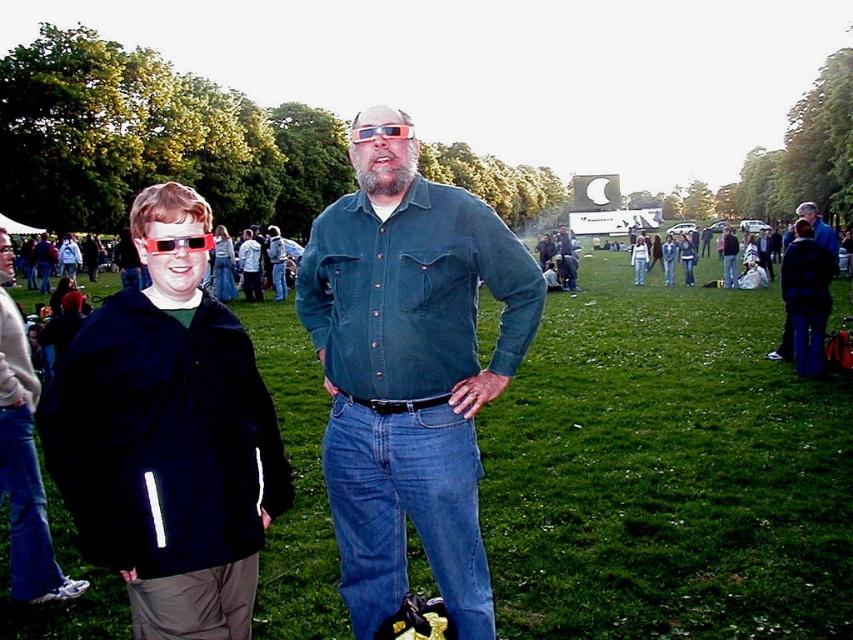
You are planning to set up a small picnic blanket in the area where the green grass at center and the denim shirt at center are located. Considering their sizes, which one would allow more space for the blanket?

The green grass at center is bigger than the denim shirt at center, so the green grass at center would provide more space for the picnic blanket.

You are planning to set up a picnic blanket in the green grass at center. Considering the size of the black fleece jacket at left, will there be enough space for the picnic blanket?

Result: The green grass at center is bigger than the black fleece jacket at left, so there should be enough space for the picnic blanket.